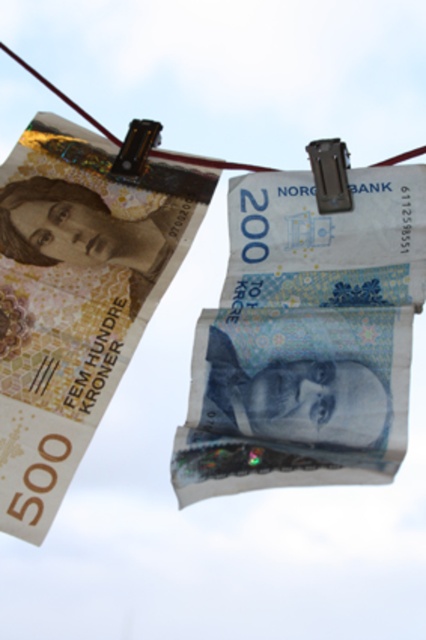
Question: Does blue paper currency at center come behind matte paper banknote at upper left?

Choices:
 (A) yes
 (B) no

Answer: (B)

Question: Which point is closer to the camera taking this photo?

Choices:
 (A) (80, 221)
 (B) (397, 368)

Answer: (B)

Question: Can you confirm if blue paper currency at center is positioned to the left of matte paper banknote at upper left?

Choices:
 (A) yes
 (B) no

Answer: (B)

Question: Which point is closer to the camera?

Choices:
 (A) tap(2, 488)
 (B) tap(213, 365)

Answer: (A)

Question: Does blue paper currency at center appear over matte paper banknote at upper left?

Choices:
 (A) yes
 (B) no

Answer: (B)